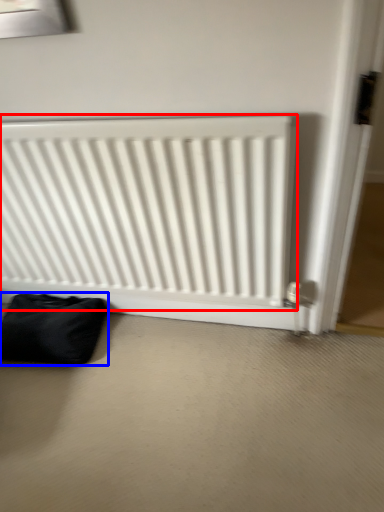
Question: Among these objects, which one is farthest to the camera, radiator (highlighted by a red box) or furniture (highlighted by a blue box)?

Choices:
 (A) radiator
 (B) furniture

Answer: (B)